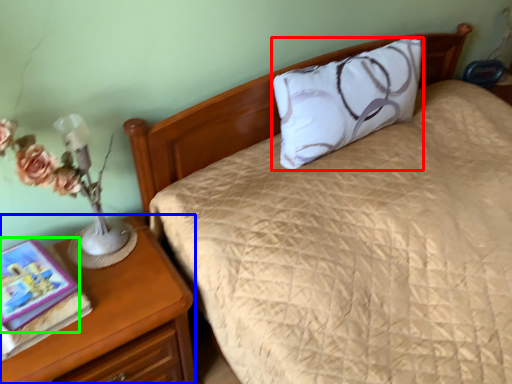
Question: Based on their relative distances, which object is nearer to pillow (highlighted by a red box)? Choose from nightstand (highlighted by a blue box) and book (highlighted by a green box).

Choices:
 (A) nightstand
 (B) book

Answer: (A)